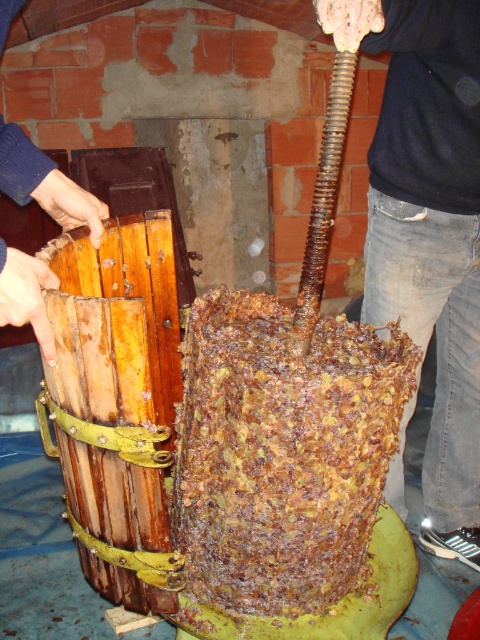
You are a winemaker trying to move the wooden crate at left to a higher shelf. Can you place it directly above the rusty metallic barrel at center?

The rusty metallic barrel at center is below the wooden crate at left, so yes, you can place the wooden crate at left directly above it since it is already positioned in that location.

You are standing in front of the wine press and see two points marked in the scene. The first point is at coordinates point (427, 49) and the second is at point (39, 323). Which point is closer to you?

Point (427, 49) is further to the camera than point (39, 323), so the second point is closer to you.

You are a visitor in a winemaking museum and you see the rusty metallic barrel at center and the jeans at center. Which object is taller?

The jeans at center are taller than the rusty metallic barrel at center.